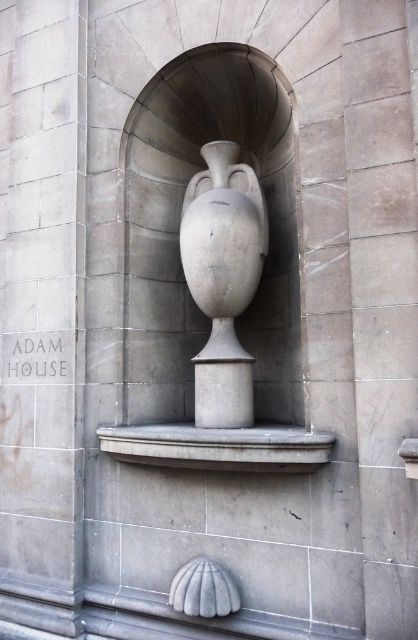
You are an art installer who needs to place a new sculpture on the gray stone ledge at center. The sculpture you have is 1.2 meters tall. The white stone vase at center is currently above the ledge. Can the sculpture fit on the ledge without touching the vase?

The white stone vase at center is above the gray stone ledge at center, so placing a 1.2 meter tall sculpture on the ledge would not interfere with the vase since the vase is positioned above it.

You are an art conservator examining the stone wall with two sculptures. You need to determine the order of the gray stone urn at center and white stone vase at center from the viewer. Which one is closer to you?

The gray stone urn at center is closer to you because the white stone vase at center is behind it.

You are an architect examining the stone wall with the niche. You see the gray stone urn at center and the gray stone ledge at center. Which object is positioned closer to the viewer?

The gray stone urn at center is closer to the viewer because the gray stone ledge at center is behind it.